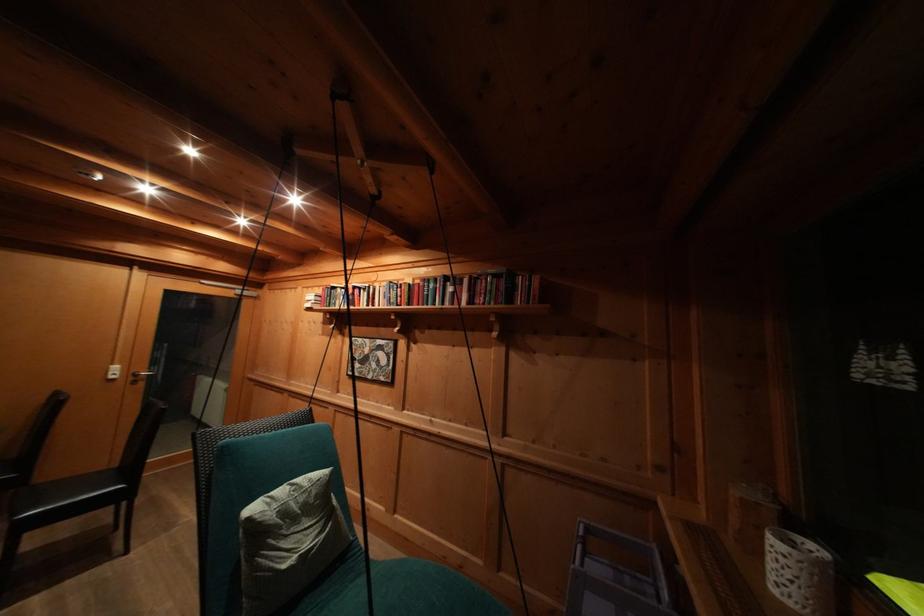
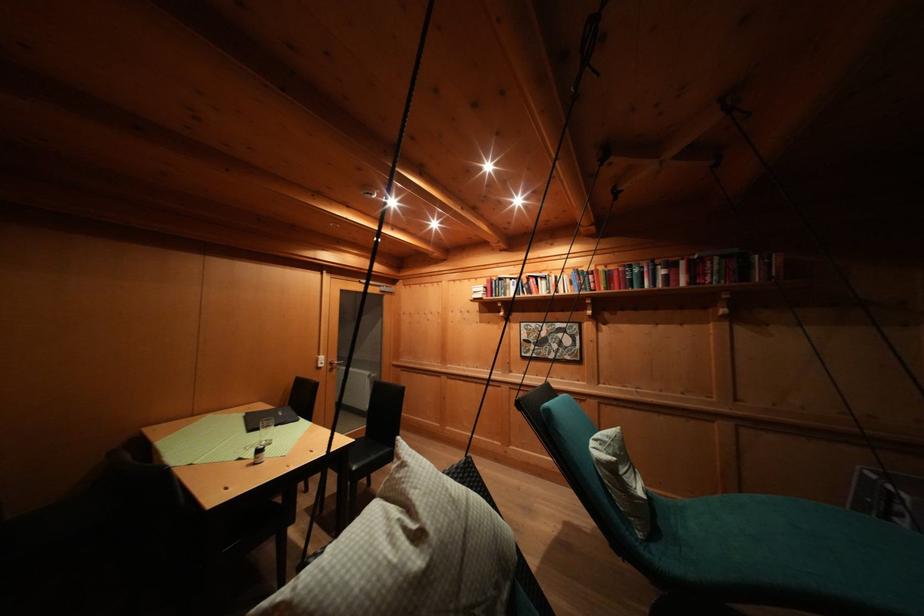
The point at [298,490] is marked in the first image. Where is the corresponding point in the second image?

(602, 445)